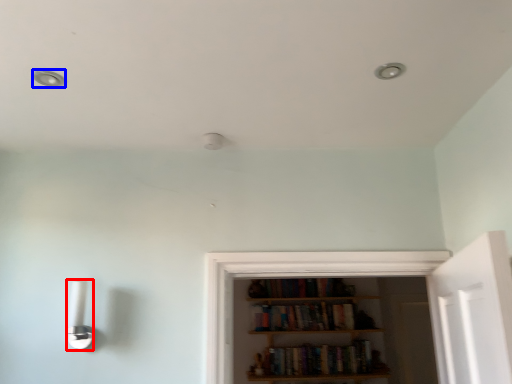
Question: Which point is further to the camera, light fixture (highlighted by a red box) or dot (highlighted by a blue box)?

Choices:
 (A) light fixture
 (B) dot

Answer: (A)